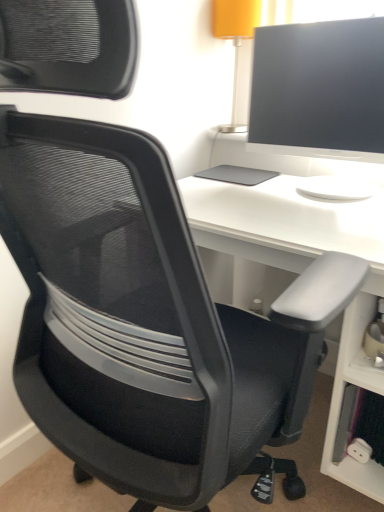
Question: Is matte black monitor at upper right bigger than white matte desk at center?

Choices:
 (A) no
 (B) yes

Answer: (A)

Question: Is matte black monitor at upper right in contact with white matte desk at center?

Choices:
 (A) yes
 (B) no

Answer: (B)

Question: Is matte black monitor at upper right aimed at white matte desk at center?

Choices:
 (A) no
 (B) yes

Answer: (A)

Question: Is matte black monitor at upper right far away from white matte desk at center?

Choices:
 (A) yes
 (B) no

Answer: (B)

Question: Is matte black monitor at upper right to the right of white matte desk at center from the viewer's perspective?

Choices:
 (A) yes
 (B) no

Answer: (A)

Question: Is matte black monitor at upper right located outside white matte desk at center?

Choices:
 (A) yes
 (B) no

Answer: (A)

Question: From the image's perspective, is white matte desk at center over matte black monitor at upper right?

Choices:
 (A) no
 (B) yes

Answer: (A)

Question: From the image's perspective, does white matte desk at center appear lower than matte black monitor at upper right?

Choices:
 (A) yes
 (B) no

Answer: (A)

Question: From a real-world perspective, is white matte desk at center beneath matte black monitor at upper right?

Choices:
 (A) no
 (B) yes

Answer: (B)

Question: Is the position of white matte desk at center more distant than that of matte black monitor at upper right?

Choices:
 (A) yes
 (B) no

Answer: (B)

Question: Can you confirm if white matte desk at center is positioned to the left of matte black monitor at upper right?

Choices:
 (A) yes
 (B) no

Answer: (A)

Question: Does white matte desk at center have a lesser width compared to matte black monitor at upper right?

Choices:
 (A) yes
 (B) no

Answer: (B)

Question: Is matte black monitor at upper right spatially inside white matte desk at center, or outside of it?

Choices:
 (A) outside
 (B) inside

Answer: (A)